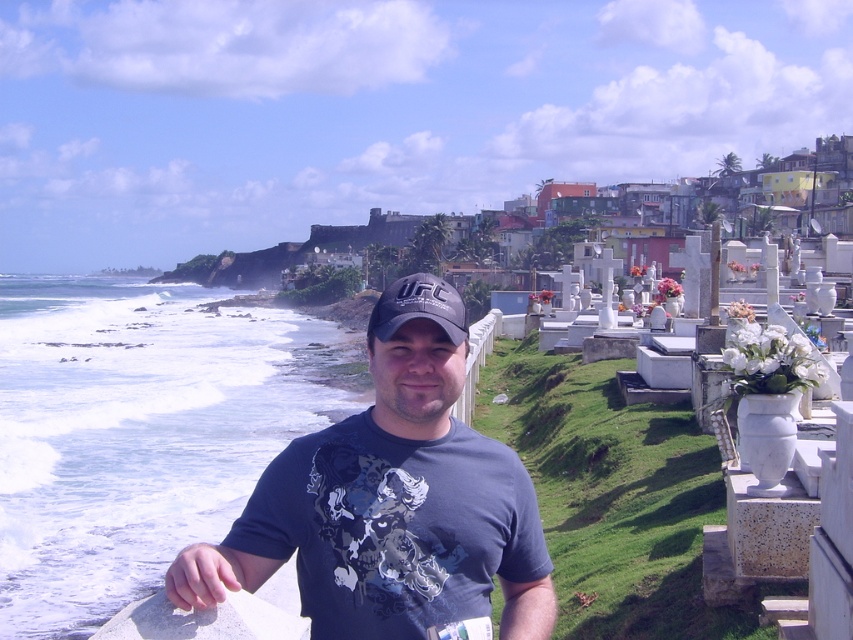
Question: Can you confirm if dark gray t-shirt at center is positioned above black fabric cap at center?

Choices:
 (A) yes
 (B) no

Answer: (B)

Question: Which point appears closest to the camera in this image?

Choices:
 (A) (416, 305)
 (B) (439, 307)

Answer: (A)

Question: Does dark gray t-shirt at center have a lesser width compared to black fabric cap at center?

Choices:
 (A) yes
 (B) no

Answer: (B)

Question: Is dark gray t-shirt at center positioned before black fabric cap at center?

Choices:
 (A) no
 (B) yes

Answer: (B)

Question: Among these points, which one is nearest to the camera?

Choices:
 (A) click(x=457, y=484)
 (B) click(x=467, y=336)

Answer: (A)